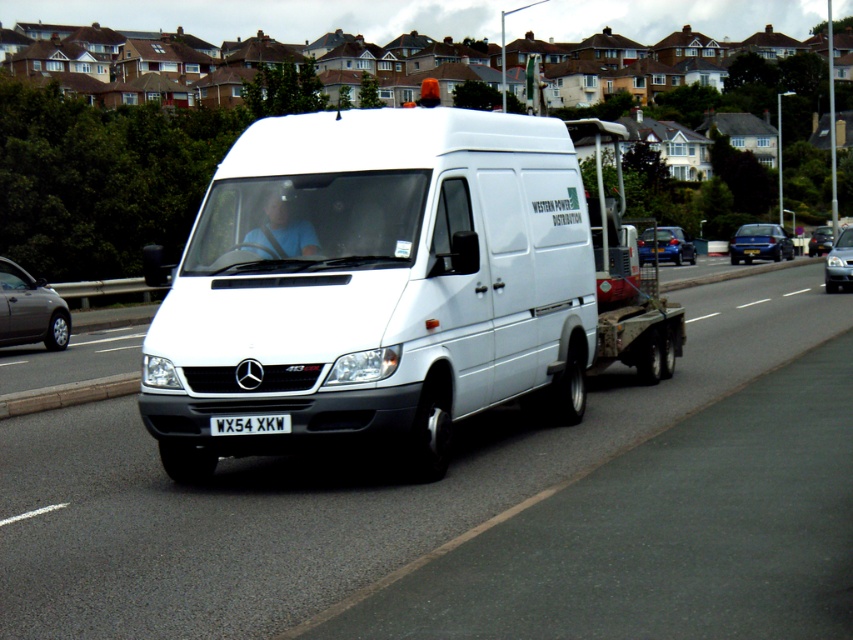
You are a delivery driver who needs to park the white matte van at center in a parking spot located at point (x=374, y=284). Can you confirm if the van is already positioned at that point?

The point (x=374, y=284) corresponds to the white matte van at center, so yes, the van is already positioned at that point.

You are a traffic officer observing a white matte flatbed truck at center and a silver metallic sedan at center on a suburban road. Which vehicle takes up more space on the road?

The white matte flatbed truck at center is larger in size than the silver metallic sedan at center, so it takes up more space on the road.

You are a pedestrian standing on the sidewalk next to the road. You see the white glossy van at center and the white matte flatbed truck at center. Which one is closer to the left side of the road?

The white glossy van at center is closer to the left side of the road because it is positioned to the left of the white matte flatbed truck at center.